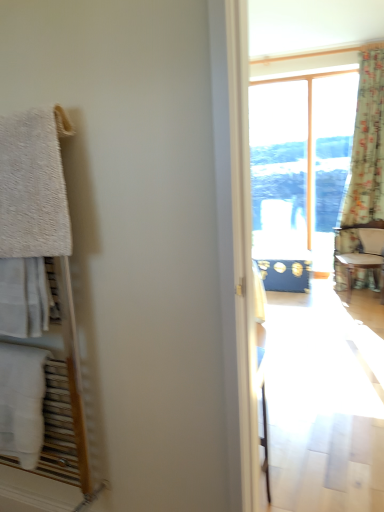
Question: From a real-world perspective, relative to wooden textured chair at right, is white fluffy towel at left, placed as the 2th towel/napkin when sorted from bottom to top, vertically above or below?

Choices:
 (A) below
 (B) above

Answer: (B)

Question: Is white fluffy towel at left, placed as the first towel/napkin when sorted from top to bottom, taller or shorter than wooden textured chair at right?

Choices:
 (A) tall
 (B) short

Answer: (B)

Question: Estimate the real-world distances between objects in this image. Which object is closer to the white cotton towel at left, the second towel/napkin when ordered from top to bottom?

Choices:
 (A) wooden textured chair at right
 (B) white fluffy towel at left, placed as the 2th towel/napkin when sorted from bottom to top
 (C) floral fabric curtain at right

Answer: (B)

Question: Estimate the real-world distances between objects in this image. Which object is farther from the wooden textured chair at right?

Choices:
 (A) white fluffy towel at left, placed as the 2th towel/napkin when sorted from bottom to top
 (B) floral fabric curtain at right
 (C) white cotton towel at left, the second towel/napkin when ordered from top to bottom

Answer: (A)